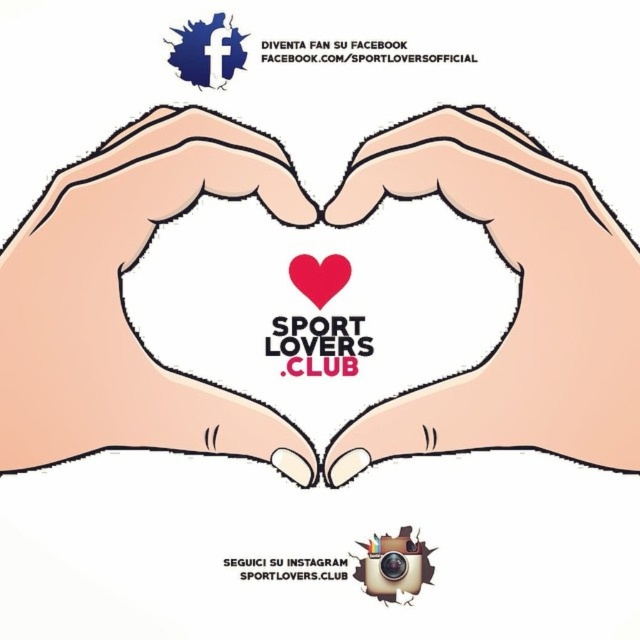
You are designing a digital poster and want to ensure the pink matte hands at center and the pink matte heart at center are proportionate. Based on the image, which object is shorter in height?

The pink matte hands at center are shorter in height than the pink matte heart at center.

You are designing a digital ad and need to ensure proper alignment between the smooth beige hand at center and the pink matte heart at center. Which object should be placed higher to maintain visual hierarchy?

The pink matte heart at center should be placed higher than the smooth beige hand at center to maintain visual hierarchy since the description states that the smooth beige hand at center is below the pink matte heart at center.